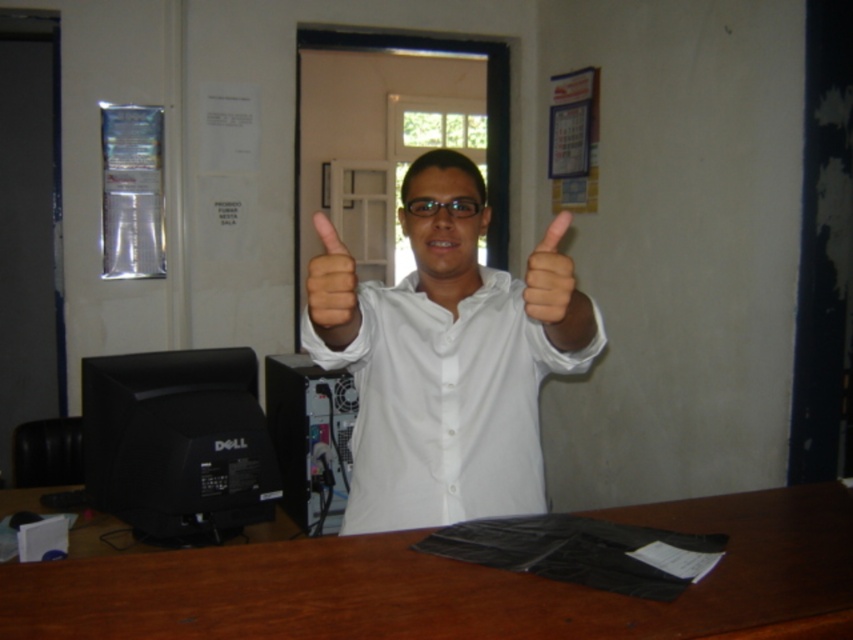
Question: Which point appears farthest from the camera in this image?

Choices:
 (A) (584, 330)
 (B) (212, 384)

Answer: (B)

Question: Can you confirm if black plastic computer tower at center is thinner than matte white hand at center?

Choices:
 (A) yes
 (B) no

Answer: (B)

Question: Which object appears closest to the camera in this image?

Choices:
 (A) white glossy shirt at center
 (B) black plastic computer tower at center
 (C) skinny white hand at center

Answer: (C)

Question: Is brown wood table at center to the right of black matte monitor at lower left from the viewer's perspective?

Choices:
 (A) no
 (B) yes

Answer: (B)

Question: In this image, where is brown wood table at center located relative to skinny white hand at center?

Choices:
 (A) below
 (B) above

Answer: (A)

Question: Which object is closer to the camera taking this photo?

Choices:
 (A) skinny white hand at center
 (B) brown wood table at center
 (C) black matte monitor at lower left
 (D) matte white hand at center

Answer: (B)